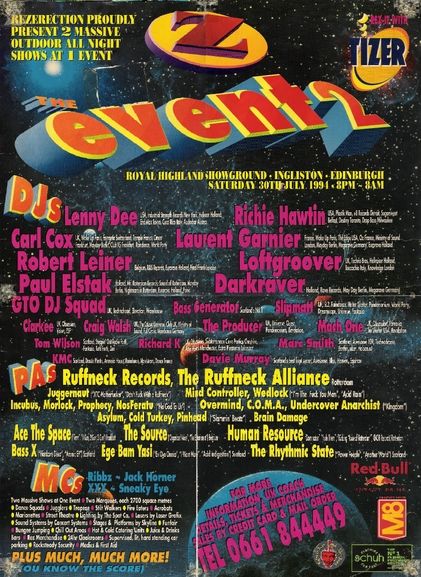
The height and width of the screenshot is (577, 421). In order to click on poster in this screenshot , I will do `click(406, 263)`.